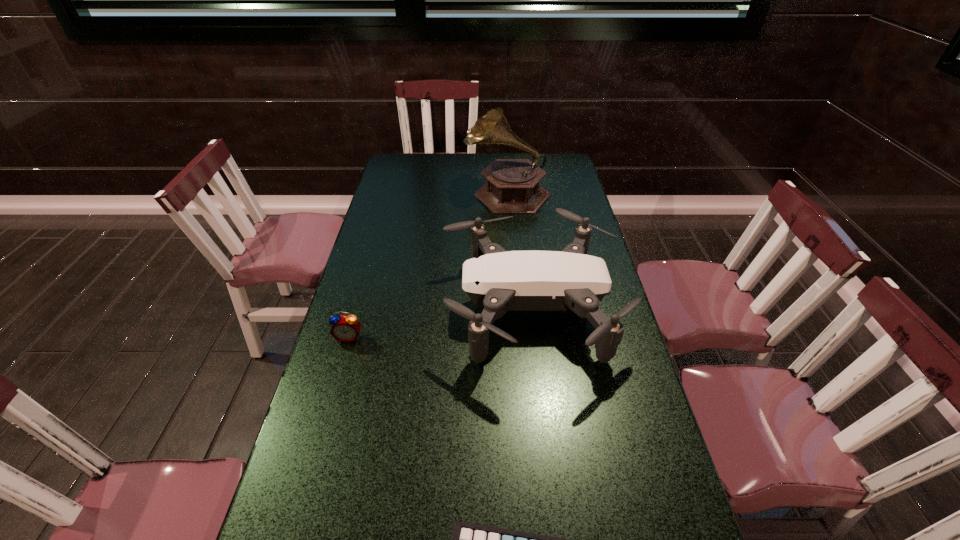
This screenshot has height=540, width=960. What are the coordinates of `vacant space at the far left corner of the desktop` in the screenshot? It's located at (412, 154).

Image resolution: width=960 pixels, height=540 pixels. Find the location of `unoccupied area between the third shortest object and the third tallest object`. unoccupied area between the third shortest object and the third tallest object is located at coordinates (440, 322).

Where is `free space between the third tallest object and the phonograph record`? Image resolution: width=960 pixels, height=540 pixels. free space between the third tallest object and the phonograph record is located at coordinates (428, 265).

Locate an element on the screen. Image resolution: width=960 pixels, height=540 pixels. free space that is in between the tallest object and the drone is located at coordinates (518, 249).

This screenshot has width=960, height=540. What are the coordinates of `unoccupied position between the alarm clock and the tallest object` in the screenshot? It's located at (428, 265).

Point out which object is positioned as the nearest to the third tallest object. Please provide its 2D coordinates. Your answer should be formatted as a tuple, i.e. [(x, y)], where the tuple contains the x and y coordinates of a point satisfying the conditions above.

[(496, 280)]

Point out which object is positioned as the second nearest to the alarm clock. Please provide its 2D coordinates. Your answer should be formatted as a tuple, i.e. [(x, y)], where the tuple contains the x and y coordinates of a point satisfying the conditions above.

[(467, 539)]

Where is `vacant space that satisfies the following two spatial constraints: 1. on the camera side of the second tallest object; 2. on the front-facing side of the third tallest object`? The height and width of the screenshot is (540, 960). vacant space that satisfies the following two spatial constraints: 1. on the camera side of the second tallest object; 2. on the front-facing side of the third tallest object is located at coordinates (534, 337).